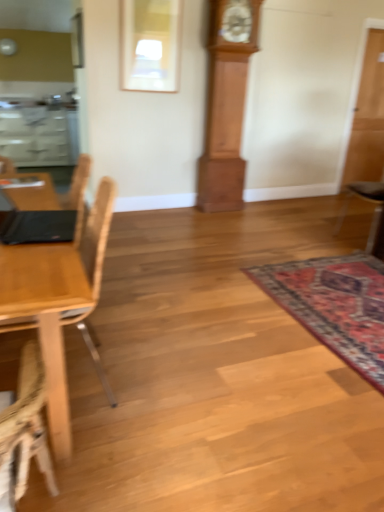
Identify the location of carpeted rug at lower right. (334, 305).

Measure the distance between point (x=12, y=282) and camera.

The depth of point (x=12, y=282) is 4.20 feet.

Locate an element on the screen. The width and height of the screenshot is (384, 512). black leather chair at right, the second chair from the left is located at coordinates (374, 213).

Locate an element on the screen. Image resolution: width=384 pixels, height=512 pixels. wooden grandfather clock at center is located at coordinates (226, 103).

Considering their positions, is black leather chair at right, marked as the 2th chair in a front-to-back arrangement, located in front of or behind light wood chair at left, marked as the 1th chair in a front-to-back arrangement?

In the image, black leather chair at right, marked as the 2th chair in a front-to-back arrangement, appears behind light wood chair at left, marked as the 1th chair in a front-to-back arrangement.

Is black leather chair at right, the second chair from the left, not close to light wood chair at left, which is counted as the second chair, starting from the right?

black leather chair at right, the second chair from the left, is far away from light wood chair at left, which is counted as the second chair, starting from the right.

Between black leather chair at right, which ranks as the first chair in back-to-front order, and light wood chair at left, which is counted as the second chair, starting from the right, which one has less height?

Standing shorter between the two is light wood chair at left, which is counted as the second chair, starting from the right.

Is point (359, 183) closer to camera compared to point (35, 326)?

No, (359, 183) is further to viewer.

Between black leather chair at right, marked as the 2th chair in a front-to-back arrangement, and carpeted rug at lower right, which one appears on the right side from the viewer's perspective?

black leather chair at right, marked as the 2th chair in a front-to-back arrangement, is more to the right.

What's the angular difference between black leather chair at right, marked as the 2th chair in a front-to-back arrangement, and carpeted rug at lower right's facing directions?

The angle between the facing direction of black leather chair at right, marked as the 2th chair in a front-to-back arrangement, and the facing direction of carpeted rug at lower right is 178 degrees.

Considering the sizes of objects black leather chair at right, which ranks as the first chair in back-to-front order, and carpeted rug at lower right in the image provided, who is smaller, black leather chair at right, which ranks as the first chair in back-to-front order, or carpeted rug at lower right?

carpeted rug at lower right.

Can you confirm if light wood chair at left, which is counted as the second chair, starting from the right, is wider than black leather chair at right, which ranks as the first chair in back-to-front order?

In fact, light wood chair at left, which is counted as the second chair, starting from the right, might be narrower than black leather chair at right, which ranks as the first chair in back-to-front order.

Which object is positioned more to the right, light wood chair at left, which is counted as the second chair, starting from the right, or black leather chair at right, which ranks as the first chair in back-to-front order?

black leather chair at right, which ranks as the first chair in back-to-front order.

What's the angular difference between light wood chair at left, marked as the 1th chair in a front-to-back arrangement, and black leather chair at right, which ranks as the first chair in back-to-front order,'s facing directions?

The angular difference between light wood chair at left, marked as the 1th chair in a front-to-back arrangement, and black leather chair at right, which ranks as the first chair in back-to-front order, is 1.62 degrees.

Is light wood chair at left, marked as the 1th chair in a front-to-back arrangement, bigger than black leather chair at right, which ranks as the first chair in back-to-front order?

Yes.

Between transparent glass door at right and carpeted rug at lower right, which one has smaller size?

carpeted rug at lower right is smaller.

Considering the positions of point (381, 112) and point (267, 291), is point (381, 112) closer or farther from the camera than point (267, 291)?

Point (381, 112) is positioned farther from the camera compared to point (267, 291).

Between transparent glass door at right and carpeted rug at lower right, which one is positioned in front?

carpeted rug at lower right.

In the image, is carpeted rug at lower right on the left side or the right side of black leather chair at right, which ranks as the first chair in back-to-front order?

From the image, it's evident that carpeted rug at lower right is to the left of black leather chair at right, which ranks as the first chair in back-to-front order.

What's the angular difference between carpeted rug at lower right and black leather chair at right, which ranks as the first chair in back-to-front order,'s facing directions?

They differ by 178 degrees in their facing directions.

Considering the relative sizes of carpeted rug at lower right and black leather chair at right, which is counted as the first chair, starting from the right, in the image provided, is carpeted rug at lower right wider than black leather chair at right, which is counted as the first chair, starting from the right,?

Yes.

Considering the positions of point (358, 119) and point (219, 106), is point (358, 119) closer or farther from the camera than point (219, 106)?

Point (358, 119) appears to be farther away from the viewer than point (219, 106).

How different are the orientations of transparent glass door at right and wooden grandfather clock at center in degrees?

The angle between the facing direction of transparent glass door at right and the facing direction of wooden grandfather clock at center is 0.798 degrees.

Is transparent glass door at right completely or partially outside of wooden grandfather clock at center?

Yes, transparent glass door at right is located beyond the bounds of wooden grandfather clock at center.

Does transparent glass door at right turn towards wooden grandfather clock at center?

No, transparent glass door at right is not facing towards wooden grandfather clock at center.

Considering the sizes of objects transparent glass door at right and black leather chair at right, which is counted as the first chair, starting from the right, in the image provided, who is thinner, transparent glass door at right or black leather chair at right, which is counted as the first chair, starting from the right,?

Thinner between the two is transparent glass door at right.

Who is more distant, transparent glass door at right or black leather chair at right, which is counted as the first chair, starting from the right?

transparent glass door at right is more distant.

Which is in front, point (369, 175) or point (383, 220)?

The point (383, 220) is closer.

Is transparent glass door at right not inside black leather chair at right, the second chair from the left?

Yes, transparent glass door at right is located beyond the bounds of black leather chair at right, the second chair from the left.

Where is `chair lying on the left of black leather chair at right, which ranks as the first chair in back-to-front order`? chair lying on the left of black leather chair at right, which ranks as the first chair in back-to-front order is located at coordinates (71, 274).

At what (x,y) coordinates should I click in order to perform the action: click on mat that appears in front of the black leather chair at right, which is counted as the first chair, starting from the right. Please return your answer as a coordinate pair (x, y). This screenshot has width=384, height=512. Looking at the image, I should click on (334, 305).

Looking at this image, which object lies nearer to the anchor point carpeted rug at lower right, transparent glass door at right or black leather chair at right, marked as the 2th chair in a front-to-back arrangement?

black leather chair at right, marked as the 2th chair in a front-to-back arrangement, lies closer to carpeted rug at lower right than the other object.

Estimate the real-world distances between objects in this image. Which object is further from black leather chair at right, which ranks as the first chair in back-to-front order, light wood chair at left, which is counted as the second chair, starting from the right, or wooden grandfather clock at center?

light wood chair at left, which is counted as the second chair, starting from the right, is further to black leather chair at right, which ranks as the first chair in back-to-front order.

Looking at the image, which one is located further to transparent glass door at right, carpeted rug at lower right or black leather chair at right, which ranks as the first chair in back-to-front order?

The object further to transparent glass door at right is carpeted rug at lower right.

From the image, which object appears to be nearer to black leather chair at right, which is counted as the first chair, starting from the right, transparent glass door at right or carpeted rug at lower right?

transparent glass door at right lies closer to black leather chair at right, which is counted as the first chair, starting from the right, than the other object.

Based on the photo, when comparing their distances from transparent glass door at right, does black leather chair at right, which ranks as the first chair in back-to-front order, or carpeted rug at lower right seem further?

carpeted rug at lower right lies further to transparent glass door at right than the other object.

Considering their positions, is transparent glass door at right positioned closer to wooden grandfather clock at center than carpeted rug at lower right?

transparent glass door at right is positioned closer to the anchor wooden grandfather clock at center.

When comparing their distances from black leather chair at right, which ranks as the first chair in back-to-front order, does wooden grandfather clock at center or transparent glass door at right seem closer?

transparent glass door at right is positioned closer to the anchor black leather chair at right, which ranks as the first chair in back-to-front order.

Considering their positions, is black leather chair at right, marked as the 2th chair in a front-to-back arrangement, positioned further to transparent glass door at right than light wood chair at left, marked as the 1th chair in a front-to-back arrangement?

Among the two, light wood chair at left, marked as the 1th chair in a front-to-back arrangement, is located further to transparent glass door at right.

Where is `mat between light wood chair at left, the 1th chair from the left, and black leather chair at right, marked as the 2th chair in a front-to-back arrangement, in the horizontal direction`? The image size is (384, 512). mat between light wood chair at left, the 1th chair from the left, and black leather chair at right, marked as the 2th chair in a front-to-back arrangement, in the horizontal direction is located at coordinates (334, 305).

The width and height of the screenshot is (384, 512). Identify the location of chair located between light wood chair at left, which appears as the second chair when viewed from the back, and wooden grandfather clock at center in the depth direction. tap(374, 213).

Find the location of `clock positioned between carpeted rug at lower right and transparent glass door at right from near to far`. clock positioned between carpeted rug at lower right and transparent glass door at right from near to far is located at coordinates (226, 103).

You are a GUI agent. You are given a task and a screenshot of the screen. Output one action in this format:
    pyautogui.click(x=<x>, y=<y>)
    Task: Click on the clock between light wood chair at left, marked as the 1th chair in a front-to-back arrangement, and transparent glass door at right in the front-back direction
    
    Given the screenshot: What is the action you would take?
    pyautogui.click(x=226, y=103)